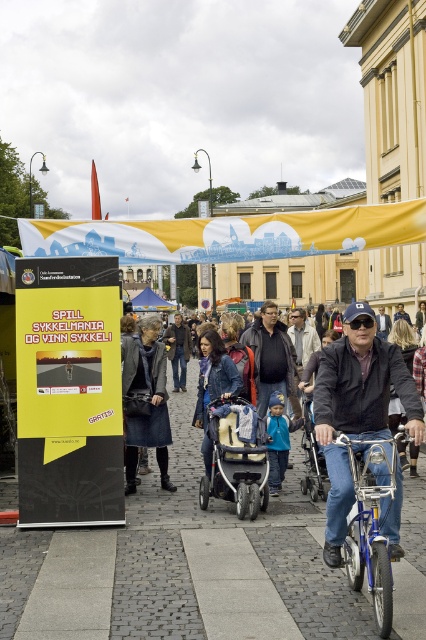
Question: Is leather jacket at center to the right of yellow fabric canopy at center from the viewer's perspective?

Choices:
 (A) yes
 (B) no

Answer: (A)

Question: Which object is closer to the camera taking this photo?

Choices:
 (A) denim jacket at center
 (B) dark brown leather jacket at center

Answer: (A)

Question: Is denim jacket at center positioned at the back of blue metallic bicycle at lower right?

Choices:
 (A) yes
 (B) no

Answer: (A)

Question: In this image, where is leather jacket at center located relative to dark brown leather jacket at center?

Choices:
 (A) above
 (B) below

Answer: (B)

Question: Estimate the real-world distances between objects in this image. Which object is closer to the silver metallic stroller at center?

Choices:
 (A) blue metallic bicycle at lower right
 (B) dark brown leather jacket at center
 (C) leather jacket at center
 (D) denim jacket at center

Answer: (C)

Question: Considering the real-world distances, which object is farthest from the leather jacket at center?

Choices:
 (A) blue metallic bicycle at lower right
 (B) denim jacket at center
 (C) yellow fabric canopy at center

Answer: (C)